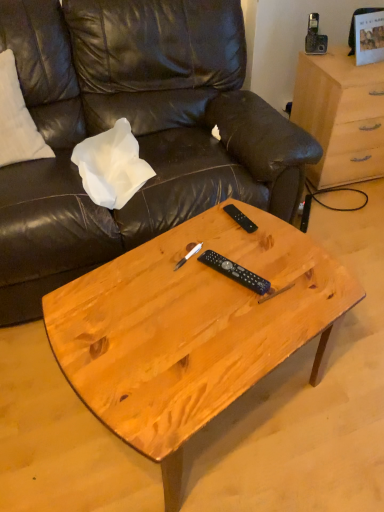
Question: In the image, is leather couch at center positioned in front of or behind white paper at upper left?

Choices:
 (A) front
 (B) behind

Answer: (A)

Question: Looking at their shapes, would you say leather couch at center is wider or thinner than white paper at upper left?

Choices:
 (A) thin
 (B) wide

Answer: (B)

Question: Which object is the farthest from the leather couch at center?

Choices:
 (A) black plastic remote at center, marked as the 1th remote in a top-to-bottom arrangement
 (B) white paper at upper left
 (C) light brown wood desk at upper right
 (D) black plastic remote at center, acting as the 2th remote starting from the top
 (E) natural wood coffee table at center

Answer: (D)

Question: Which object is the farthest from the light brown wood desk at upper right?

Choices:
 (A) white paper at upper left
 (B) black plastic remote at center, placed as the second remote when sorted from bottom to top
 (C) leather couch at center
 (D) natural wood coffee table at center
 (E) black plastic remote at center, the 1th remote viewed from the front

Answer: (E)